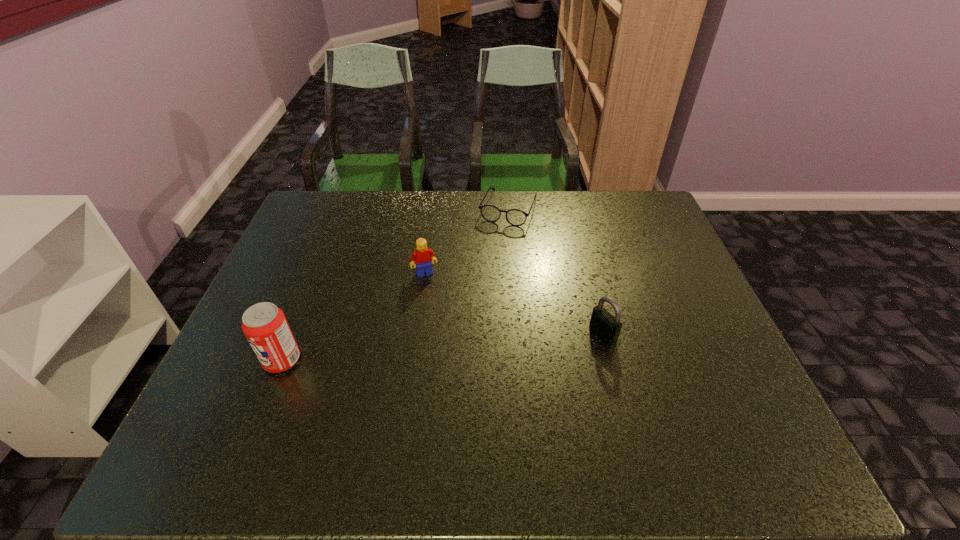
Where is `vacant space at the right edge of the desktop`? This screenshot has height=540, width=960. vacant space at the right edge of the desktop is located at coordinates (664, 337).

Where is `vacant space at the far right corner of the desktop`? vacant space at the far right corner of the desktop is located at coordinates (630, 191).

I want to click on vacant space at the near right corner of the desktop, so click(684, 403).

The image size is (960, 540). Find the location of `vacant space that is in between the Lego and the soda can`. vacant space that is in between the Lego and the soda can is located at coordinates (353, 316).

Find the location of a particular element. empty location between the farthest object and the padlock is located at coordinates (556, 272).

The image size is (960, 540). Find the location of `vacant area that lies between the second object from left to right and the rightmost object`. vacant area that lies between the second object from left to right and the rightmost object is located at coordinates (514, 303).

Identify the location of vacant area between the second object from left to right and the soda can. (353, 316).

Identify the location of free point between the Lego and the padlock. (514, 303).

You are a GUI agent. You are given a task and a screenshot of the screen. Output one action in this format:
    pyautogui.click(x=<x>, y=<y>)
    Task: Click on the vacant area between the padlock and the tallest object
    The height and width of the screenshot is (540, 960).
    Given the screenshot: What is the action you would take?
    pyautogui.click(x=443, y=347)

Find the location of `vacant point located between the rightmost object and the Lego`. vacant point located between the rightmost object and the Lego is located at coordinates (514, 303).